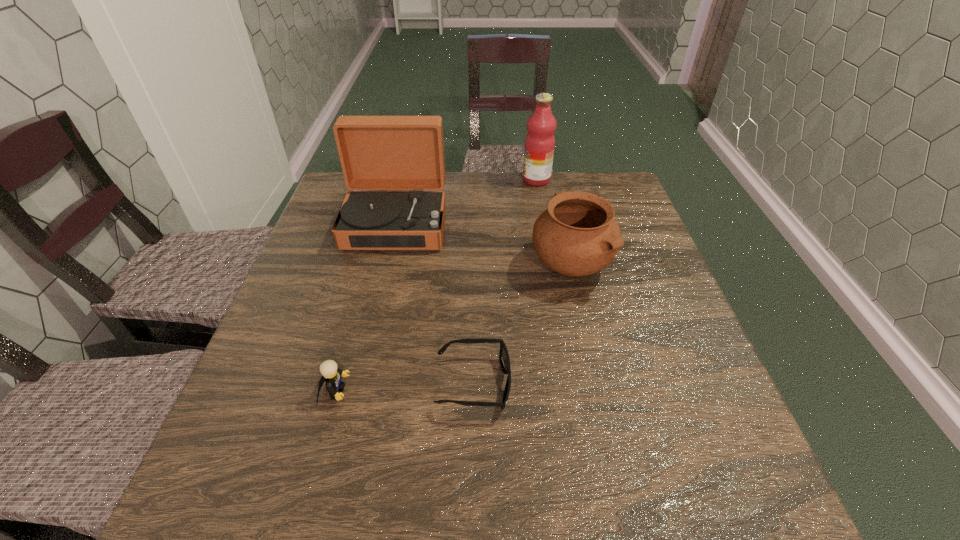
In order to click on free point between the pottery and the fourth tallest object in this screenshot , I will do tap(452, 328).

Image resolution: width=960 pixels, height=540 pixels. Identify the location of free space between the third object from right to left and the Lego. (404, 388).

I want to click on vacant space that is in between the phonograph record and the shortest object, so click(x=435, y=304).

Where is `the third closest object to the Lego`? The image size is (960, 540). the third closest object to the Lego is located at coordinates (577, 235).

Where is `object that ranks as the third closest to the third object from right to left`? The height and width of the screenshot is (540, 960). object that ranks as the third closest to the third object from right to left is located at coordinates (376, 152).

This screenshot has height=540, width=960. What are the coordinates of `free spot that satisfies the following two spatial constraints: 1. on the face of the phonograph record; 2. on the front-facing side of the Lego` in the screenshot? It's located at (356, 392).

This screenshot has height=540, width=960. Find the location of `vacant space that satisfies the following two spatial constraints: 1. on the front side of the third tallest object; 2. on the front-facing side of the shortest object`. vacant space that satisfies the following two spatial constraints: 1. on the front side of the third tallest object; 2. on the front-facing side of the shortest object is located at coordinates coord(597,383).

Locate an element on the screen. vacant space that satisfies the following two spatial constraints: 1. on the label of the farthest object; 2. on the face of the phonograph record is located at coordinates (544, 225).

The width and height of the screenshot is (960, 540). I want to click on vacant space that satisfies the following two spatial constraints: 1. on the face of the phonograph record; 2. on the front-facing side of the fourth tallest object, so click(356, 392).

The height and width of the screenshot is (540, 960). What are the coordinates of `free location that satisfies the following two spatial constraints: 1. on the front side of the pottery; 2. on the front-facing side of the Lego` in the screenshot? It's located at (599, 392).